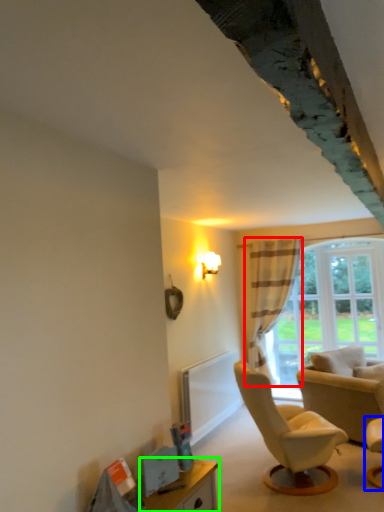
Question: Which is nearer to the curtain (highlighted by a red box)? chair (highlighted by a blue box) or table (highlighted by a green box).

Choices:
 (A) chair
 (B) table

Answer: (A)